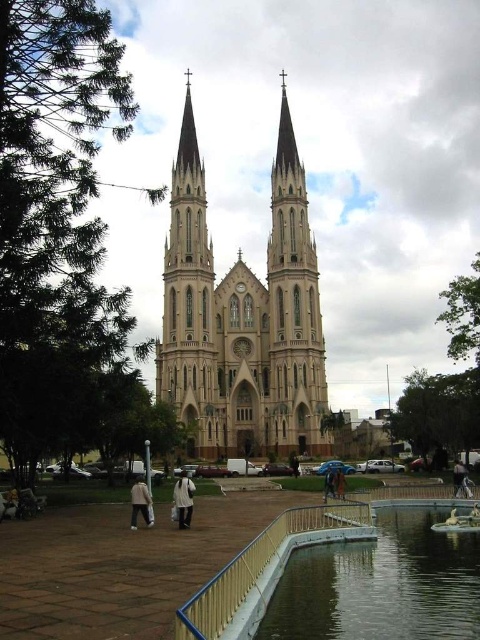
Measure the distance from smooth beige tower at center to white matte coat at center.

They are 29.59 meters apart.

Is smooth beige tower at center bigger than white matte coat at center?

Yes, smooth beige tower at center is bigger than white matte coat at center.

Is point (168, 292) farther from viewer compared to point (183, 481)?

Yes, point (168, 292) is farther from viewer.

Identify the location of smooth beige tower at center. The width and height of the screenshot is (480, 640). (191, 305).

I want to click on beige stone church at center, so click(242, 317).

Can you confirm if beige stone church at center is positioned to the right of brown leather jacket at center?

In fact, beige stone church at center is to the left of brown leather jacket at center.

Find the location of a particular element. beige stone church at center is located at coordinates (242, 317).

At what (x,y) coordinates should I click in order to perform the action: click on beige stone church at center. Please return your answer as a coordinate pair (x, y). The width and height of the screenshot is (480, 640). Looking at the image, I should click on (242, 317).

Can you confirm if beige stone church at center is smaller than white matte coat at center?

Actually, beige stone church at center might be larger than white matte coat at center.

This screenshot has width=480, height=640. In order to click on beige stone church at center in this screenshot , I will do `click(242, 317)`.

Which is behind, point (215, 424) or point (173, 488)?

The point (215, 424) is behind.

The image size is (480, 640). What are the coordinates of `beige stone church at center` in the screenshot? It's located at (242, 317).